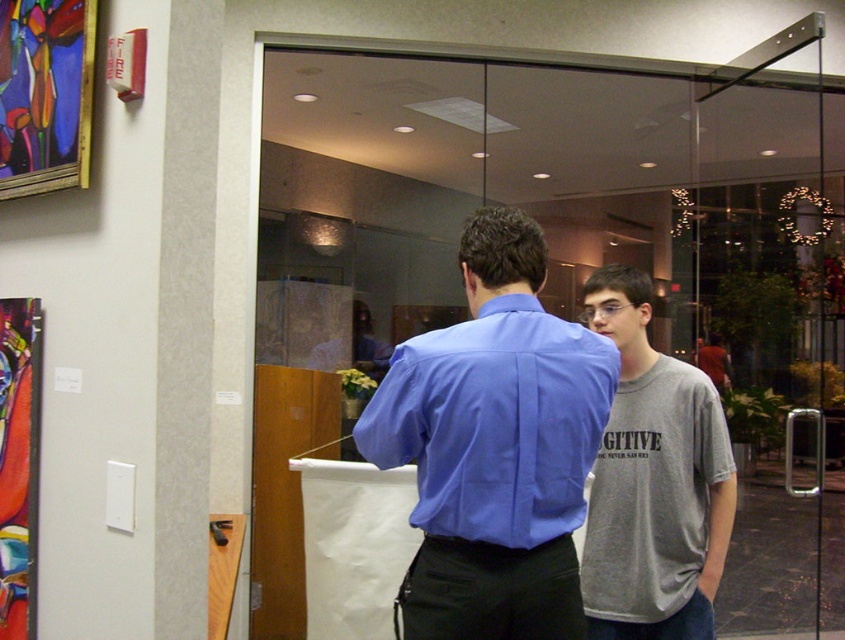
Question: Estimate the real-world distances between objects in this image. Which object is closer to the gray cotton t-shirt at center?

Choices:
 (A) matte blue dress shirt at center
 (B) abstract painting at left

Answer: (A)

Question: Can you confirm if matte blue dress shirt at center is thinner than abstract painting at left?

Choices:
 (A) yes
 (B) no

Answer: (B)

Question: Is matte blue dress shirt at center to the right of abstract painting at left from the viewer's perspective?

Choices:
 (A) yes
 (B) no

Answer: (A)

Question: Which of the following is the farthest from the observer?

Choices:
 (A) gray cotton t-shirt at center
 (B) abstract painting at left

Answer: (A)

Question: Estimate the real-world distances between objects in this image. Which object is closer to the gray cotton t-shirt at center?

Choices:
 (A) abstract painting at left
 (B) matte blue dress shirt at center

Answer: (B)

Question: Can you confirm if gray cotton t-shirt at center is positioned to the right of abstract painting at left?

Choices:
 (A) no
 (B) yes

Answer: (B)